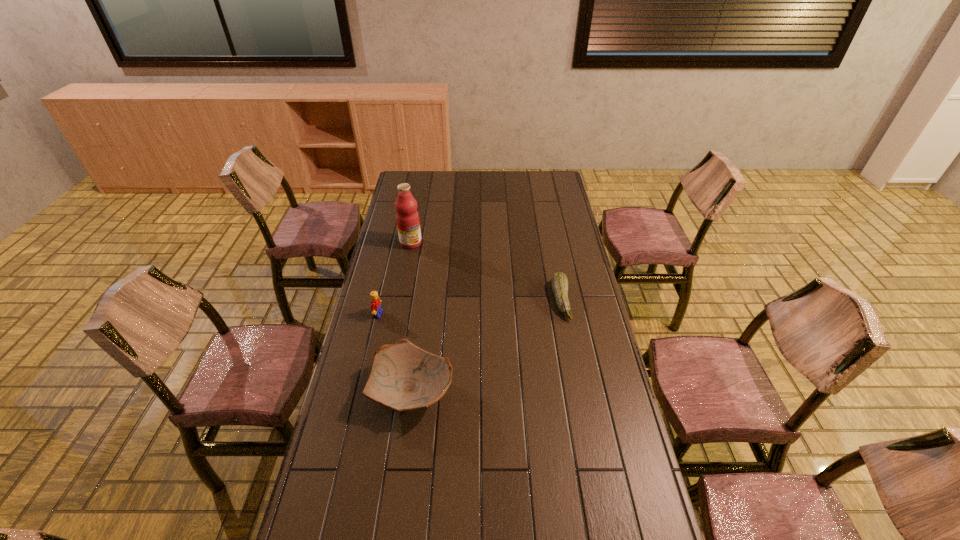
You are a GUI agent. You are given a task and a screenshot of the screen. Output one action in this format:
    pyautogui.click(x=<x>, y=<y>)
    Task: Click on the nearest object
    The width and height of the screenshot is (960, 540).
    Given the screenshot: What is the action you would take?
    pyautogui.click(x=404, y=377)

Locate an element on the screen. The image size is (960, 540). zucchini is located at coordinates (559, 281).

This screenshot has height=540, width=960. What are the coordinates of `the rightmost object` in the screenshot? It's located at (559, 281).

At what (x,y) coordinates should I click in order to perform the action: click on the leftmost object. Please return your answer as a coordinate pair (x, y). Looking at the image, I should click on (375, 306).

Locate an element on the screen. This screenshot has height=540, width=960. the tallest object is located at coordinates (407, 217).

This screenshot has width=960, height=540. I want to click on fruit juice, so click(x=407, y=217).

Locate an element on the screen. The width and height of the screenshot is (960, 540). blank space located 0.210m on the front of the nearest object is located at coordinates (398, 498).

Find the location of a particular element. This screenshot has width=960, height=540. vacant area located on the face of the Lego is located at coordinates (418, 319).

Identify the location of vacant space located on the face of the Lego. The height and width of the screenshot is (540, 960). (443, 322).

At what (x,y) coordinates should I click in order to perform the action: click on vacant region located on the face of the Lego. Please return your answer as a coordinate pair (x, y). Image resolution: width=960 pixels, height=540 pixels. Looking at the image, I should click on (402, 318).